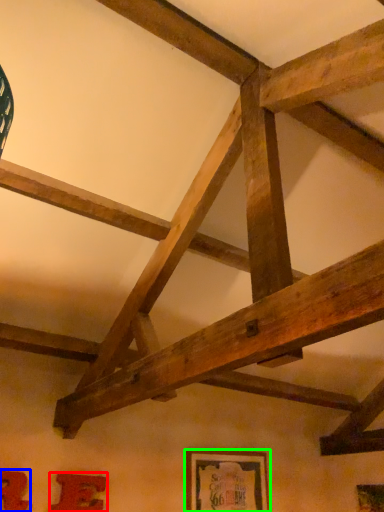
Question: Considering the real-world distances, which object is closest to picture frame (highlighted by a red box)? picture frame (highlighted by a blue box) or picture frame (highlighted by a green box).

Choices:
 (A) picture frame
 (B) picture frame

Answer: (A)